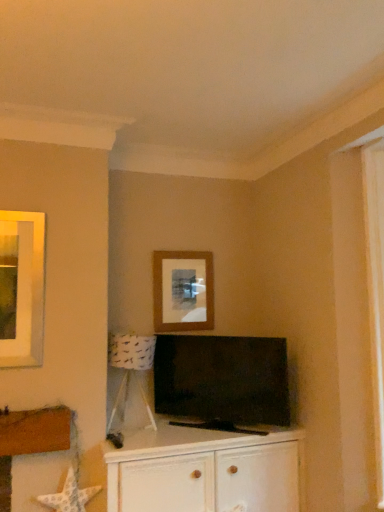
I want to click on vacant area that is in front of white paper lampshade at lower left, so click(x=148, y=442).